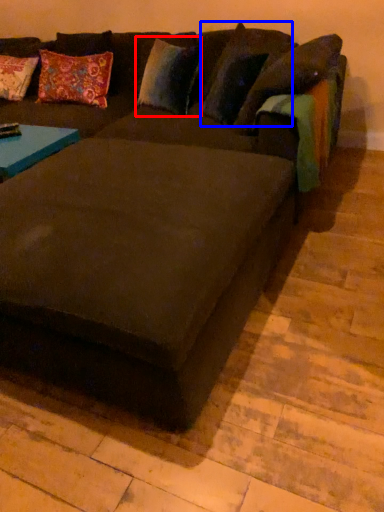
Question: Among these objects, which one is farthest to the camera, pillow (highlighted by a red box) or pillow (highlighted by a blue box)?

Choices:
 (A) pillow
 (B) pillow

Answer: (A)